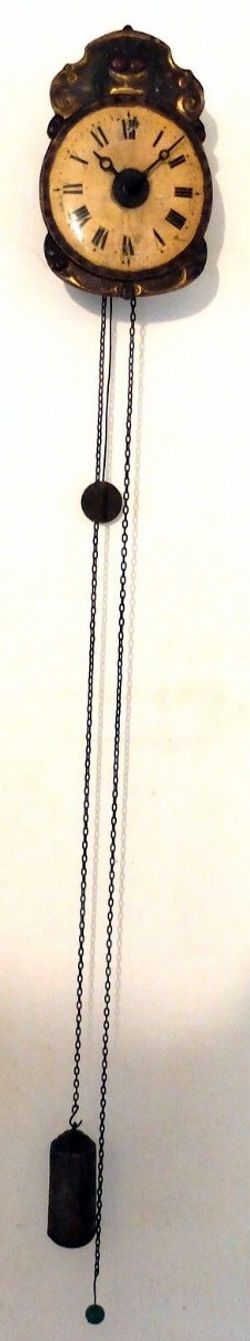
Find the location of a particular element. This screenshot has width=250, height=1341. clock is located at coordinates click(112, 213).